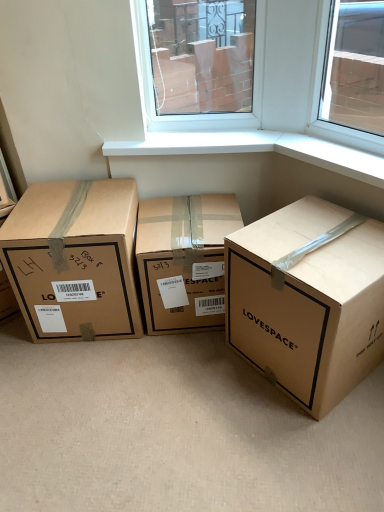
Where is `free location in front of brown cardboard box at center, acting as the first box starting from the right`? free location in front of brown cardboard box at center, acting as the first box starting from the right is located at coordinates (313, 439).